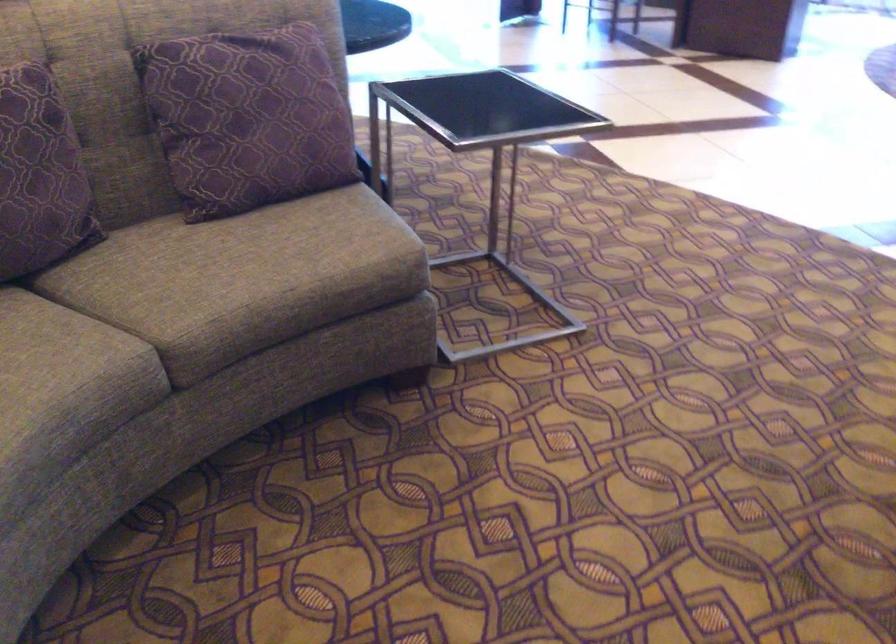
Identify the location of sofa armrest. The image size is (896, 644). (467, 312).